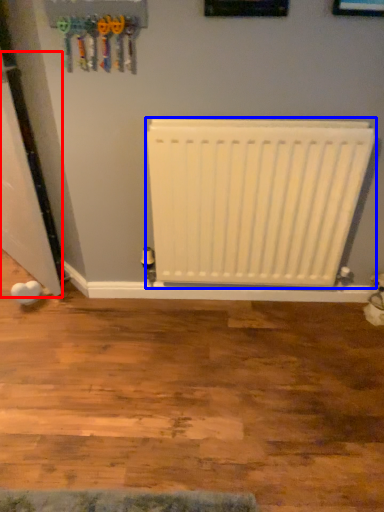
Question: Which object is closer to the camera taking this photo, door (highlighted by a red box) or radiator (highlighted by a blue box)?

Choices:
 (A) door
 (B) radiator

Answer: (A)